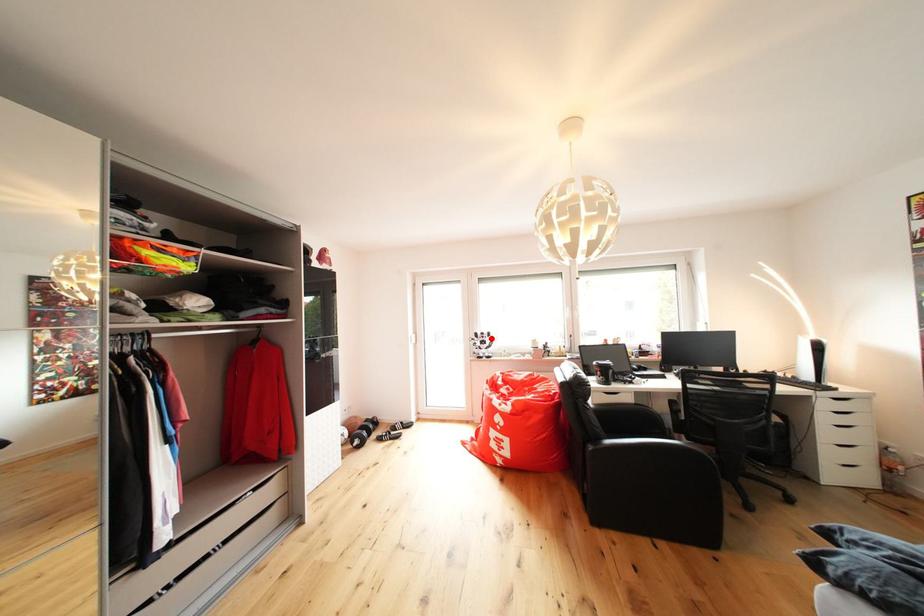
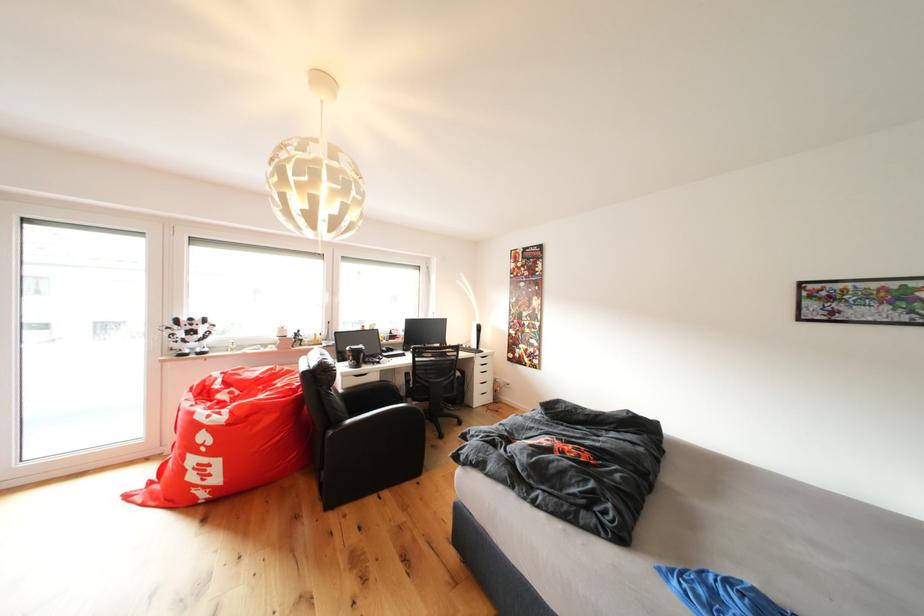
Question: I am providing you with two images of the same scene from different viewpoints. A red point is marked on the first image. Can you still see the location of the red point in image 2?

Choices:
 (A) Yes
 (B) No

Answer: (A)